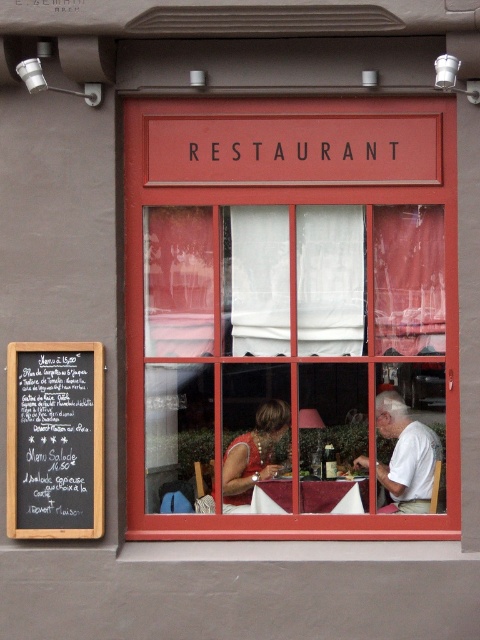
Question: Does red wooden window at center have a lesser width compared to white cotton shirt at lower right?

Choices:
 (A) yes
 (B) no

Answer: (B)

Question: Does white cotton shirt at lower right appear under matte red dress at center?

Choices:
 (A) yes
 (B) no

Answer: (B)

Question: Which point is closer to the camera taking this photo?

Choices:
 (A) (58, 342)
 (B) (386, 410)
 (C) (223, 483)
 (D) (336, 212)

Answer: (A)

Question: Which is farther from the black chalkboard at left?

Choices:
 (A) white cotton shirt at lower right
 (B) red wooden window at center
 (C) matte red dress at center

Answer: (A)

Question: Where is red wooden window at center located in relation to matte red dress at center in the image?

Choices:
 (A) left
 (B) right

Answer: (B)

Question: Among these points, which one is farthest from the camera?

Choices:
 (A) (431, 493)
 (B) (236, 496)
 (C) (391, 296)
 (D) (75, 432)

Answer: (C)